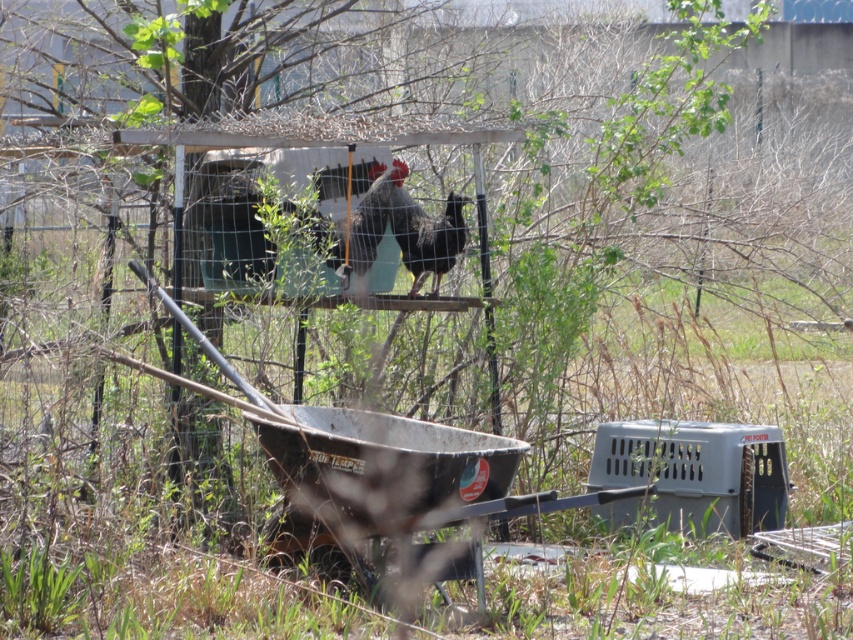
Which is in front, point (428, 272) or point (373, 259)?

Positioned in front is point (373, 259).

Measure the distance between black glossy rooster at center and silvery metallic rooster at center.

A distance of 10.61 inches exists between black glossy rooster at center and silvery metallic rooster at center.

I want to click on black glossy rooster at center, so click(x=425, y=232).